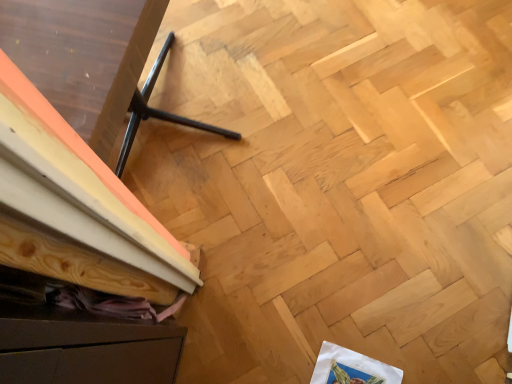
Question: From a real-world perspective, is black metal tripod at lower left physically below brown matte drawer at lower left?

Choices:
 (A) yes
 (B) no

Answer: (A)

Question: From a real-world perspective, is black metal tripod at lower left located higher than brown matte drawer at lower left?

Choices:
 (A) yes
 (B) no

Answer: (B)

Question: Could you tell me if black metal tripod at lower left is turned towards brown matte drawer at lower left?

Choices:
 (A) yes
 (B) no

Answer: (B)

Question: Does black metal tripod at lower left appear on the left side of brown matte drawer at lower left?

Choices:
 (A) yes
 (B) no

Answer: (A)

Question: Can you confirm if black metal tripod at lower left is bigger than brown matte drawer at lower left?

Choices:
 (A) no
 (B) yes

Answer: (B)

Question: Considering the positions of black metal tripod at lower left and brown matte drawer at lower left in the image, is black metal tripod at lower left taller or shorter than brown matte drawer at lower left?

Choices:
 (A) short
 (B) tall

Answer: (A)

Question: Does point (112, 339) appear closer or farther from the camera than point (93, 360)?

Choices:
 (A) closer
 (B) farther

Answer: (B)

Question: From the image's perspective, is black metal tripod at lower left positioned above or below brown matte drawer at lower left?

Choices:
 (A) below
 (B) above

Answer: (B)

Question: Visually, is black metal tripod at lower left positioned to the left or to the right of brown matte drawer at lower left?

Choices:
 (A) left
 (B) right

Answer: (A)

Question: From a real-world perspective, is white paper at lower right positioned above or below black metal tripod at lower left?

Choices:
 (A) above
 (B) below

Answer: (B)

Question: Considering the relative positions of white paper at lower right and black metal tripod at lower left in the image provided, is white paper at lower right to the left or to the right of black metal tripod at lower left?

Choices:
 (A) right
 (B) left

Answer: (A)

Question: From the image's perspective, relative to black metal tripod at lower left, is white paper at lower right above or below?

Choices:
 (A) above
 (B) below

Answer: (B)

Question: Would you say white paper at lower right is inside or outside black metal tripod at lower left?

Choices:
 (A) outside
 (B) inside

Answer: (A)

Question: In terms of height, does white paper at lower right look taller or shorter compared to brown matte drawer at lower left?

Choices:
 (A) tall
 (B) short

Answer: (B)

Question: Would you say white paper at lower right is to the left or to the right of brown matte drawer at lower left in the picture?

Choices:
 (A) right
 (B) left

Answer: (A)